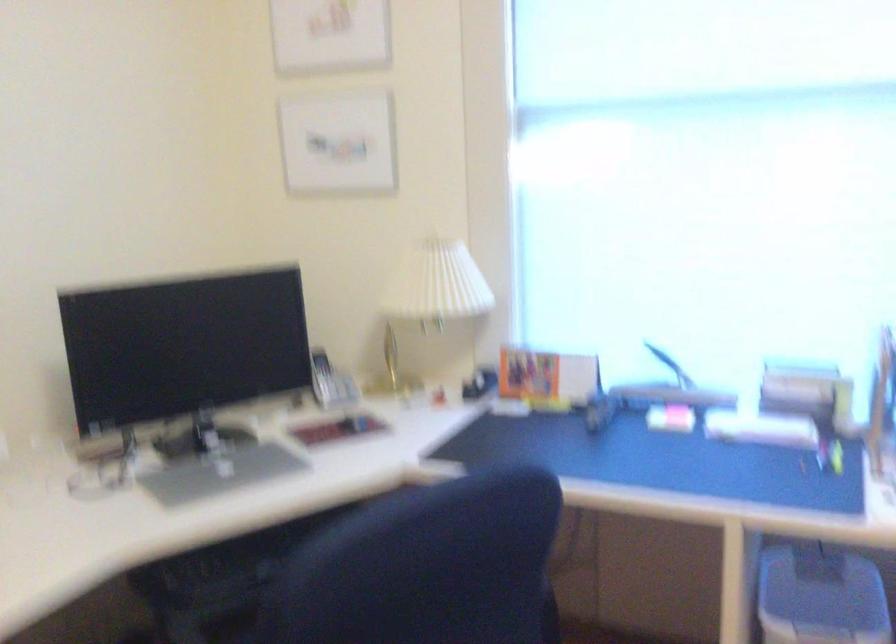
Locate an element on the screen. This screenshot has width=896, height=644. phone handset is located at coordinates (330, 382).